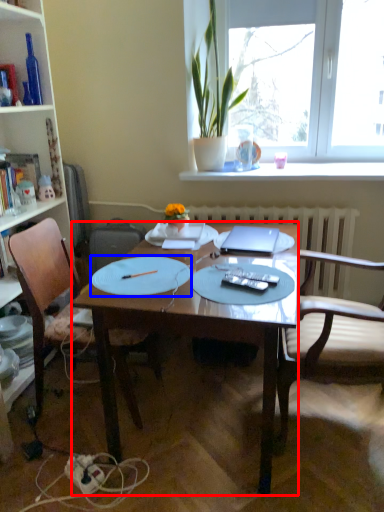
Question: Which object is further to the camera taking this photo, desk (highlighted by a red box) or paper plate (highlighted by a blue box)?

Choices:
 (A) desk
 (B) paper plate

Answer: (B)